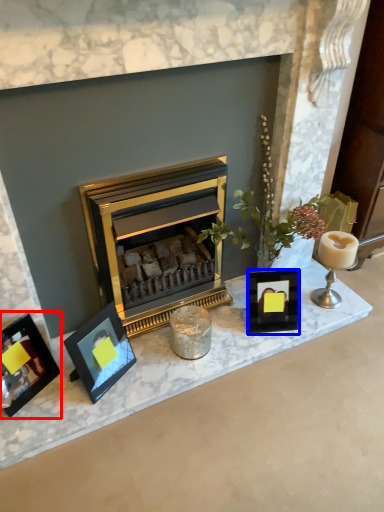
Question: Which of the following is the farthest to the observer, picture frame (highlighted by a red box) or picture frame (highlighted by a blue box)?

Choices:
 (A) picture frame
 (B) picture frame

Answer: (B)